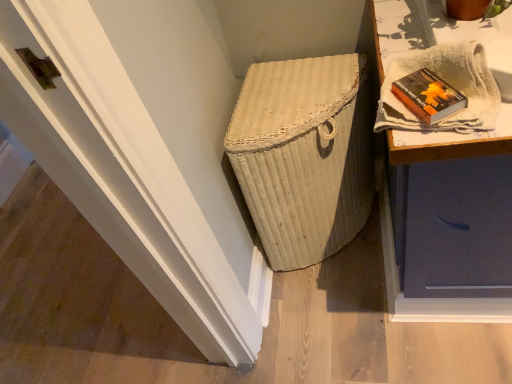
Question: Is hardcover book at upper right outside of white wicker basket at center?

Choices:
 (A) yes
 (B) no

Answer: (A)

Question: Can you confirm if hardcover book at upper right is bigger than white wicker basket at center?

Choices:
 (A) yes
 (B) no

Answer: (B)

Question: Considering the relative positions of hardcover book at upper right and white wicker basket at center in the image provided, is hardcover book at upper right to the left of white wicker basket at center from the viewer's perspective?

Choices:
 (A) yes
 (B) no

Answer: (B)

Question: Considering the relative sizes of hardcover book at upper right and white wicker basket at center in the image provided, is hardcover book at upper right smaller than white wicker basket at center?

Choices:
 (A) yes
 (B) no

Answer: (A)

Question: From a real-world perspective, is hardcover book at upper right positioned under white wicker basket at center based on gravity?

Choices:
 (A) no
 (B) yes

Answer: (A)

Question: In terms of size, does hardcover book at upper right appear bigger or smaller than white wicker basket at center?

Choices:
 (A) big
 (B) small

Answer: (B)

Question: From a real-world perspective, is hardcover book at upper right above or below white wicker basket at center?

Choices:
 (A) below
 (B) above

Answer: (B)

Question: In the image, is hardcover book at upper right positioned in front of or behind white wicker basket at center?

Choices:
 (A) behind
 (B) front

Answer: (B)

Question: Considering the relative positions of hardcover book at upper right and white wicker basket at center in the image provided, is hardcover book at upper right to the left or to the right of white wicker basket at center?

Choices:
 (A) right
 (B) left

Answer: (A)

Question: Is white wicker basket at center wider or thinner than hardcover book at upper right?

Choices:
 (A) thin
 (B) wide

Answer: (B)

Question: In terms of height, does white wicker basket at center look taller or shorter compared to hardcover book at upper right?

Choices:
 (A) tall
 (B) short

Answer: (A)

Question: Based on their positions, is white wicker basket at center located to the left or right of hardcover book at upper right?

Choices:
 (A) left
 (B) right

Answer: (A)

Question: Is white wicker basket at center situated inside hardcover book at upper right or outside?

Choices:
 (A) outside
 (B) inside

Answer: (A)

Question: Based on their sizes in the image, would you say hardcover book at upper right is bigger or smaller than white textured cloth at upper right?

Choices:
 (A) big
 (B) small

Answer: (B)

Question: Relative to white textured cloth at upper right, is hardcover book at upper right in front or behind?

Choices:
 (A) behind
 (B) front

Answer: (A)